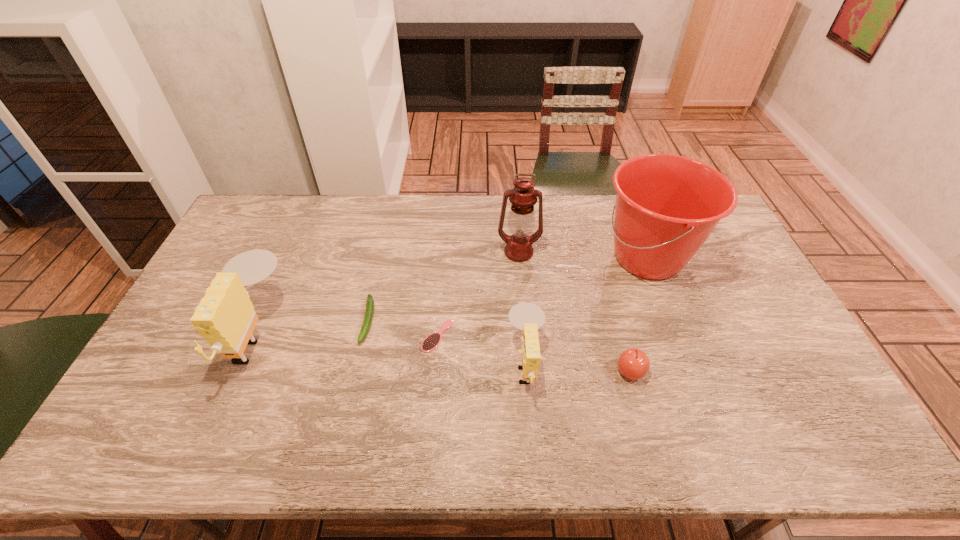
Find the location of a particular element. The width and height of the screenshot is (960, 540). free location at the near left corner is located at coordinates (173, 404).

Locate an element on the screen. This screenshot has width=960, height=540. free space between the apple and the second object from left to right is located at coordinates (499, 346).

Identify the location of free space that is in between the fifth tallest object and the bucket. (639, 315).

Locate an element on the screen. Image resolution: width=960 pixels, height=540 pixels. unoccupied area between the bucket and the fifth object from right to left is located at coordinates (542, 297).

Identify the location of vacant space that is in between the oil lamp and the fifth tallest object. The height and width of the screenshot is (540, 960). (575, 312).

The image size is (960, 540). What are the coordinates of `unoccupied area between the oil lamp and the hairbrush` in the screenshot? It's located at (478, 294).

Identify the location of blank region between the sixth tallest object and the left sponge. The image size is (960, 540). (312, 329).

Find the location of a particular element. Image resolution: width=960 pixels, height=540 pixels. empty space between the third shortest object and the taller sponge is located at coordinates (444, 354).

Find the location of a particular element. unoccupied position between the sixth tallest object and the shorter sponge is located at coordinates (447, 342).

Locate an element on the screen. The image size is (960, 540). vacant region between the fourth tallest object and the bucket is located at coordinates (587, 311).